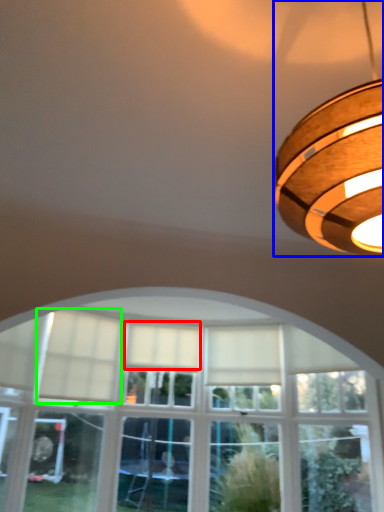
Question: Estimate the real-world distances between objects in this image. Which object is farther from curtain (highlighted by a red box), lamp (highlighted by a blue box) or curtain (highlighted by a green box)?

Choices:
 (A) lamp
 (B) curtain

Answer: (A)